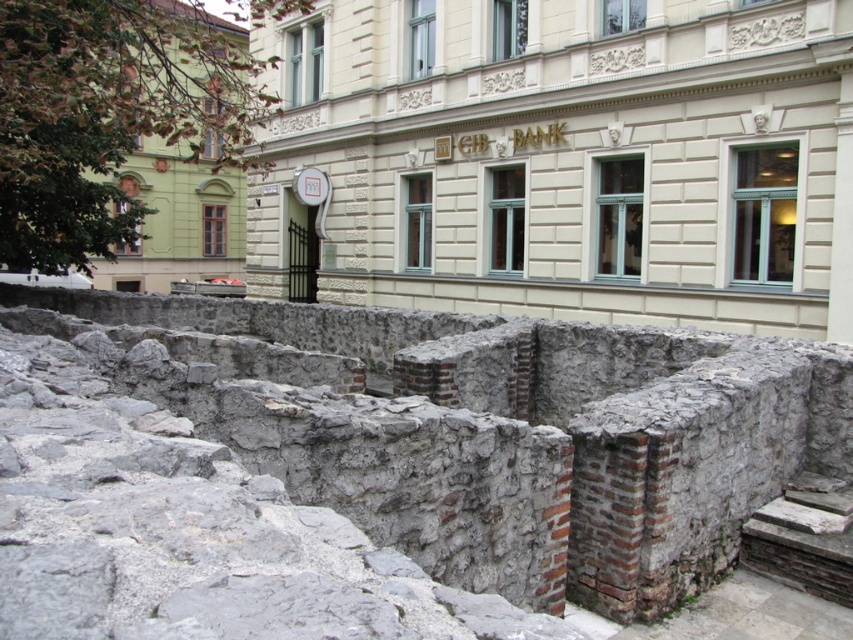
You are an architect analyzing the image of the ancient ruins and modern building. You see the stone wall ruins at center and the gray stone wall at center. Which one is placed above the other?

The stone wall ruins at center is positioned over gray stone wall at center.

You are an architect analyzing the spatial relationship between the stone wall ruins at center and the gray stone wall at center in the image. Which one is closer to the viewer?

The stone wall ruins at center is closer to the viewer than the gray stone wall at center because the gray stone wall at center is positioned behind it.